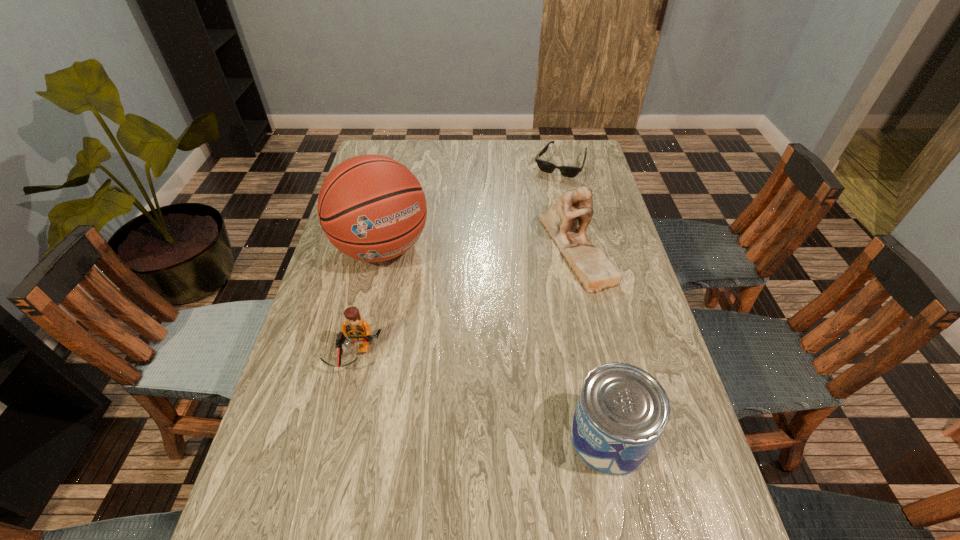
Where is `vacant space at the far edge of the desktop`? The image size is (960, 540). vacant space at the far edge of the desktop is located at coordinates (513, 159).

Identify the location of free space at the near edge of the desktop. (352, 491).

Find the location of a particular element. blank space at the left edge of the desktop is located at coordinates (338, 265).

Where is `vacant space at the right edge`? This screenshot has height=540, width=960. vacant space at the right edge is located at coordinates (608, 232).

Identify the location of free spot at the far left corner of the desktop. This screenshot has width=960, height=540. (383, 151).

This screenshot has width=960, height=540. I want to click on vacant position at the near left corner of the desktop, so click(x=291, y=475).

Find the location of a particular element. empty location between the figurine and the third tallest object is located at coordinates (591, 342).

This screenshot has height=540, width=960. What are the coordinates of `free space between the nearest object and the tallest object` in the screenshot? It's located at coord(495,342).

Locate an element on the screen. The image size is (960, 540). free space that is in between the shortest object and the third shortest object is located at coordinates (585, 301).

This screenshot has height=540, width=960. Find the location of `vacant space that's between the figurine and the can`. vacant space that's between the figurine and the can is located at coordinates (591, 342).